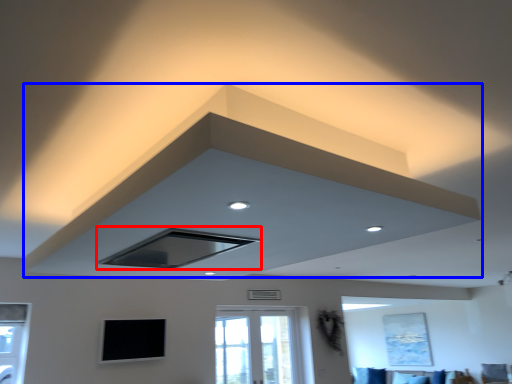
Question: Among these objects, which one is farthest to the camera, exhaust hood (highlighted by a red box) or exhaust hood (highlighted by a blue box)?

Choices:
 (A) exhaust hood
 (B) exhaust hood

Answer: (A)